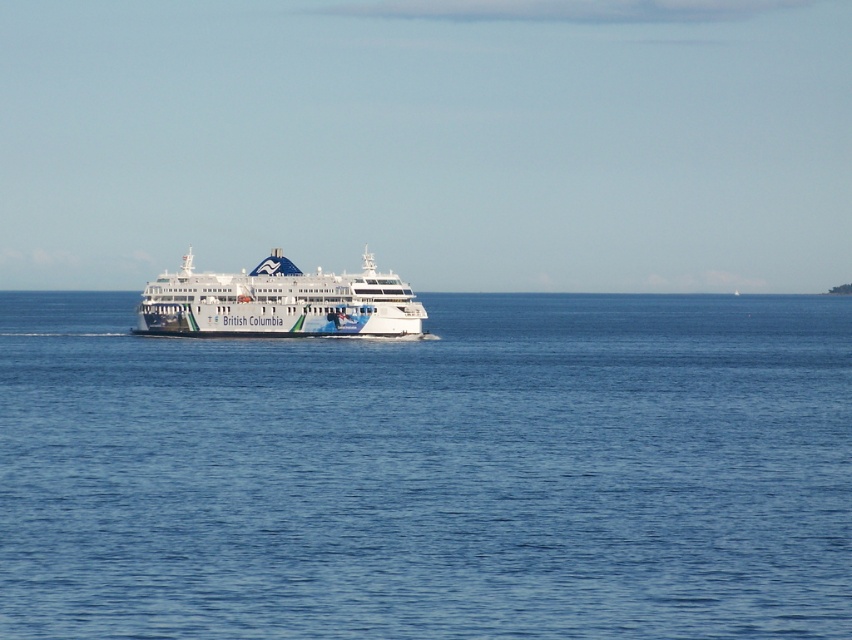
Can you confirm if blue liquid water at center is taller than white glossy ferry at center?

Incorrect, blue liquid water at center's height is not larger of white glossy ferry at center's.

This screenshot has width=852, height=640. I want to click on blue liquid water at center, so click(430, 472).

Does point (114, 572) lie in front of point (188, 314)?

Yes, point (114, 572) is closer to viewer.

The height and width of the screenshot is (640, 852). I want to click on blue liquid water at center, so click(x=430, y=472).